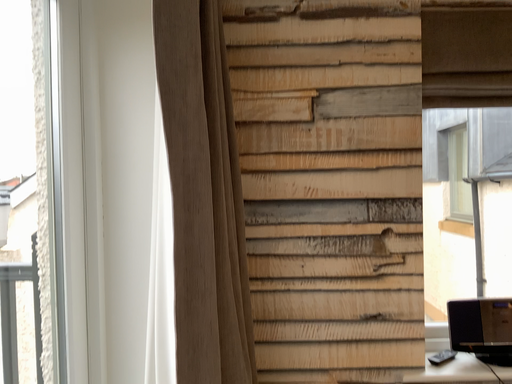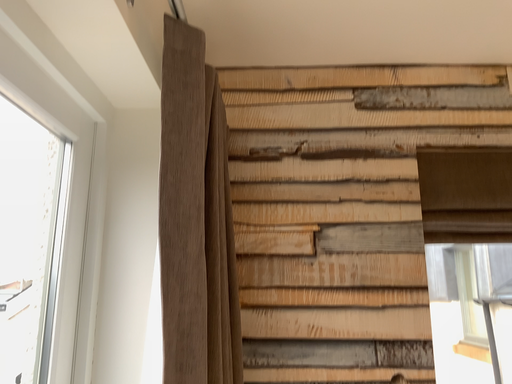
Question: Which way did the camera rotate in the video?

Choices:
 (A) rotated downward
 (B) rotated upward

Answer: (B)